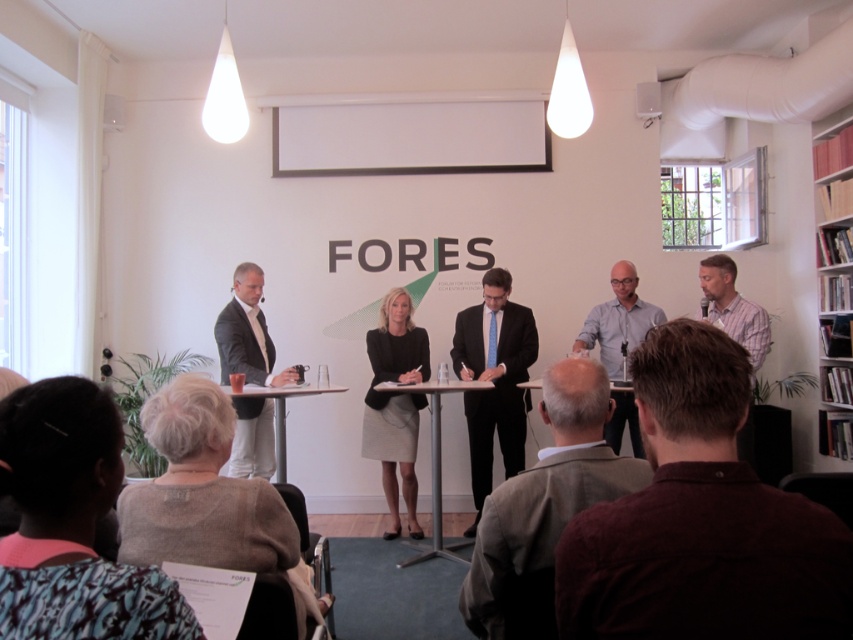
Consider the image. You are an event organizer and need to seat two new guests at the table. The guests want to sit between the light gray suit at left and the plaid cotton shirt at right. Is there space between them for both guests?

The light gray suit at left is to the left of the plaid cotton shirt at right, but there is no information provided about the distance between them. Therefore, it is uncertain if there is enough space for both guests to sit between them.

You are standing at the front of the room facing the projection screen. You need to move to a specific location in the room. The first point you need to reach is point (256, 365), and the second point is point (734, 296). Which point should you reach first to follow the correct path?

You should reach point (734, 296) first because according to the description, point (256, 365) is behind point (734, 296). This means point (734, 296) is closer to your starting position at the front of the room, so you should reach it first before moving to the point behind it.

You are standing at the back of the room facing the front. You see two points marked in the image. The first point is at coordinates point [830,609] and the second is at point [254,456]. Which point is closer to you?

Point [254,456] is closer to you because it is behind point [830,609].